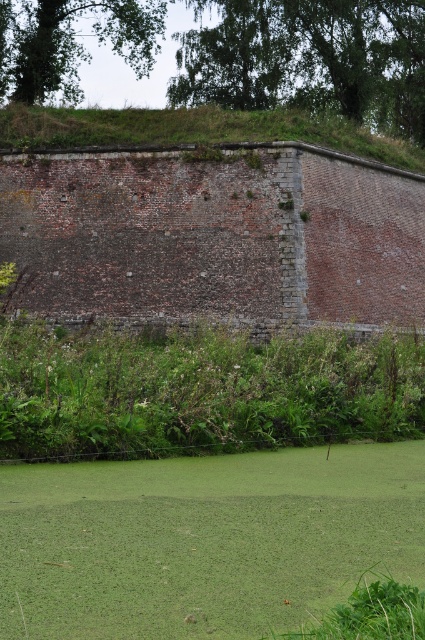
Is point (370, 476) farther from camera compared to point (172, 109)?

No, it is not.

In the scene shown: Who is positioned more to the right, green leafy grass at lower center or green leafy grass at upper center?

green leafy grass at upper center

Between point (152, 612) and point (255, 115), which one is positioned in front?

Point (152, 612) is in front.

Identify the location of green leafy grass at lower center. (204, 540).